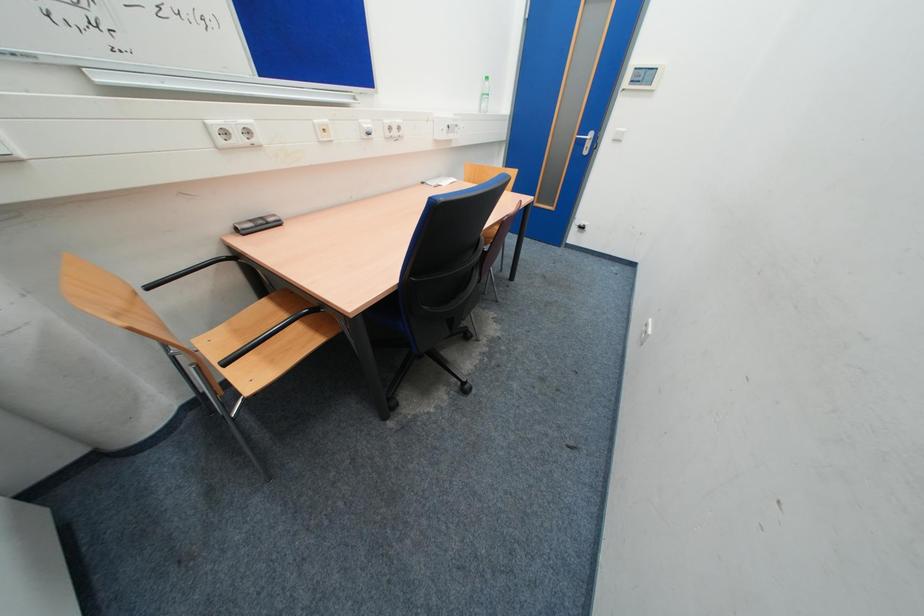
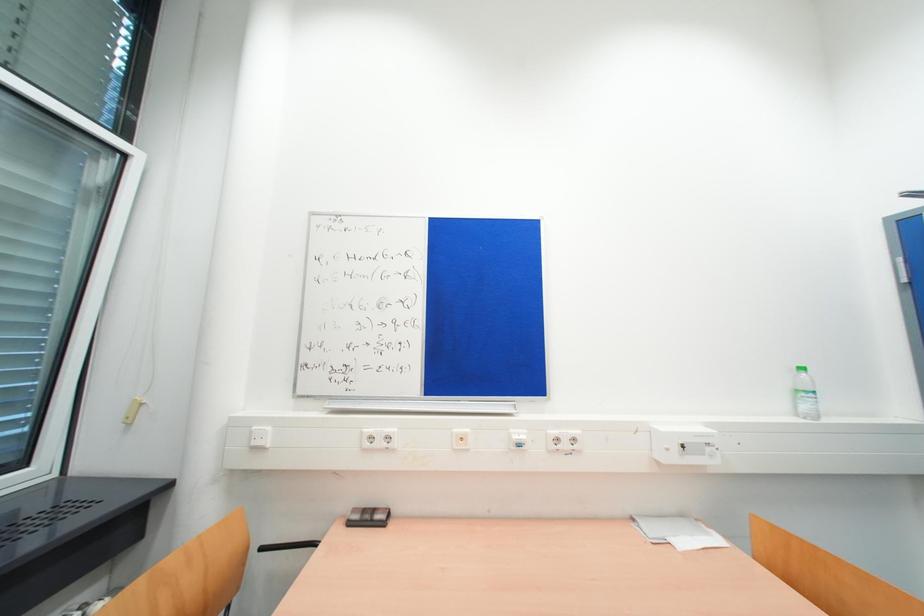
The images are taken continuously from a first-person perspective. In which direction is your viewpoint rotating?

The camera rotated toward left-up.